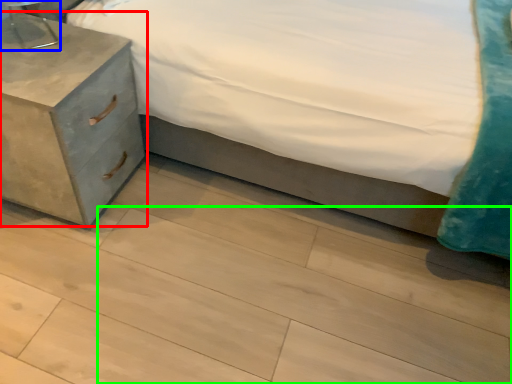
Question: Based on their relative distances, which object is nearer to nightstand (highlighted by a red box)? Choose from table lamp (highlighted by a blue box) and tile (highlighted by a green box).

Choices:
 (A) table lamp
 (B) tile

Answer: (A)